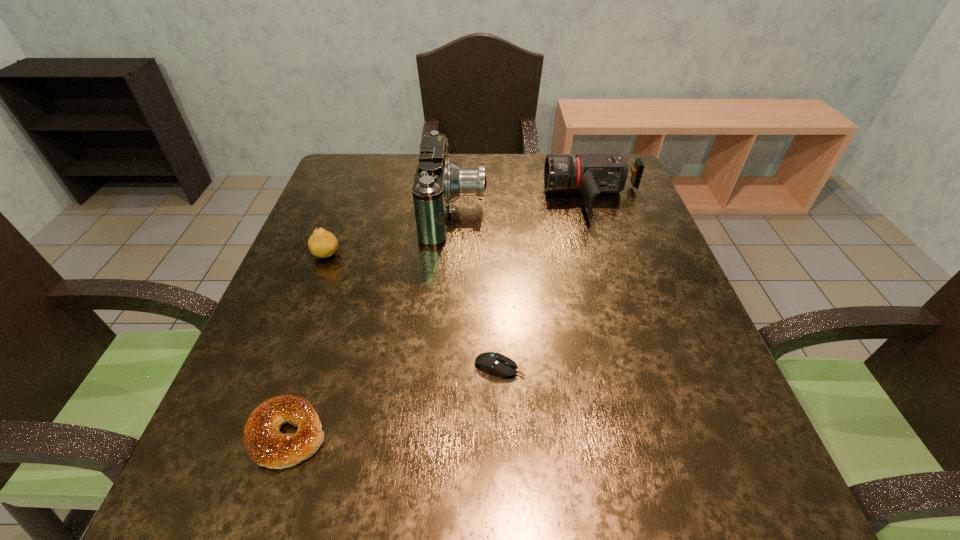
Locate an element on the screen. object that is positioned at the near left corner is located at coordinates (265, 444).

The height and width of the screenshot is (540, 960). Find the location of `object that is at the far right corner`. object that is at the far right corner is located at coordinates (590, 175).

Identify the location of free space at the far edge of the desktop. (489, 159).

Where is `vacant space at the near edge`? The width and height of the screenshot is (960, 540). vacant space at the near edge is located at coordinates (594, 498).

In the image, there is a desktop. At what (x,y) coordinates should I click in order to perform the action: click on free space at the left edge. Please return your answer as a coordinate pair (x, y). The height and width of the screenshot is (540, 960). Looking at the image, I should click on (359, 228).

Locate an element on the screen. The height and width of the screenshot is (540, 960). free space at the right edge of the desktop is located at coordinates (630, 206).

Locate an element on the screen. free spot at the far left corner of the desktop is located at coordinates (363, 192).

This screenshot has height=540, width=960. In the image, there is a desktop. In order to click on vacant space at the near left corner in this screenshot , I will do [262, 508].

I want to click on vacant area that lies between the bagel and the taller camcorder, so click(x=371, y=323).

Identify the location of free space between the tallest object and the fourth farthest object. coord(477,290).